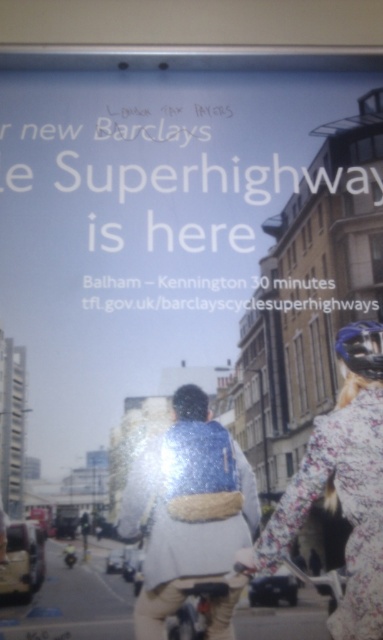
Question: Which of the following is the farthest from the observer?

Choices:
 (A) white paper poster at center
 (B) floral fabric jacket at center

Answer: (A)

Question: In this image, where is white paper poster at center located relative to shiny blue jacket at center?

Choices:
 (A) left
 (B) right

Answer: (A)

Question: Does shiny blue jacket at center appear under floral fabric jacket at center?

Choices:
 (A) no
 (B) yes

Answer: (B)

Question: Does shiny blue jacket at center appear under floral fabric jacket at center?

Choices:
 (A) yes
 (B) no

Answer: (A)

Question: Which object is farther from the camera taking this photo?

Choices:
 (A) white paper poster at center
 (B) floral fabric jacket at center

Answer: (A)

Question: Which of the following is the farthest from the observer?

Choices:
 (A) (345, 182)
 (B) (220, 504)
 (C) (379, 637)

Answer: (A)